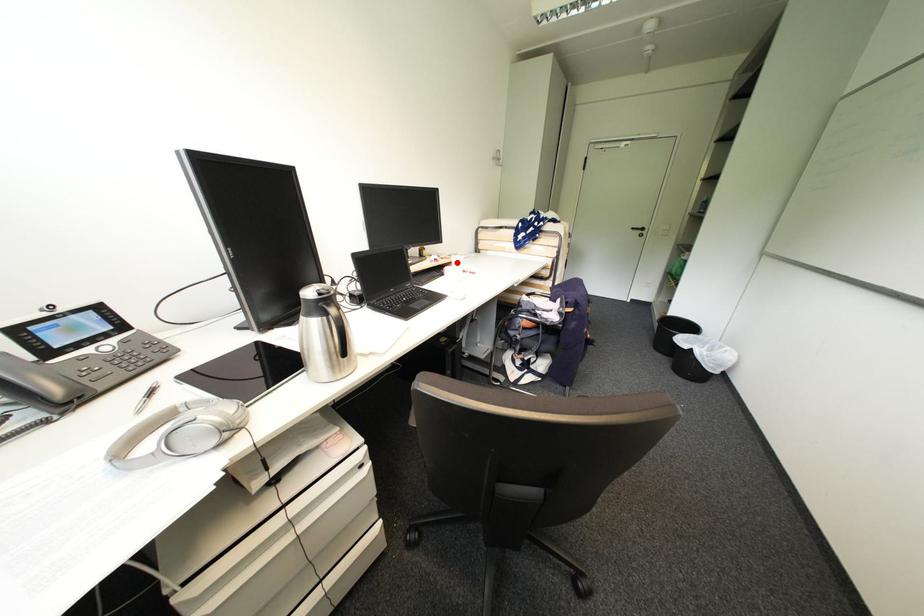
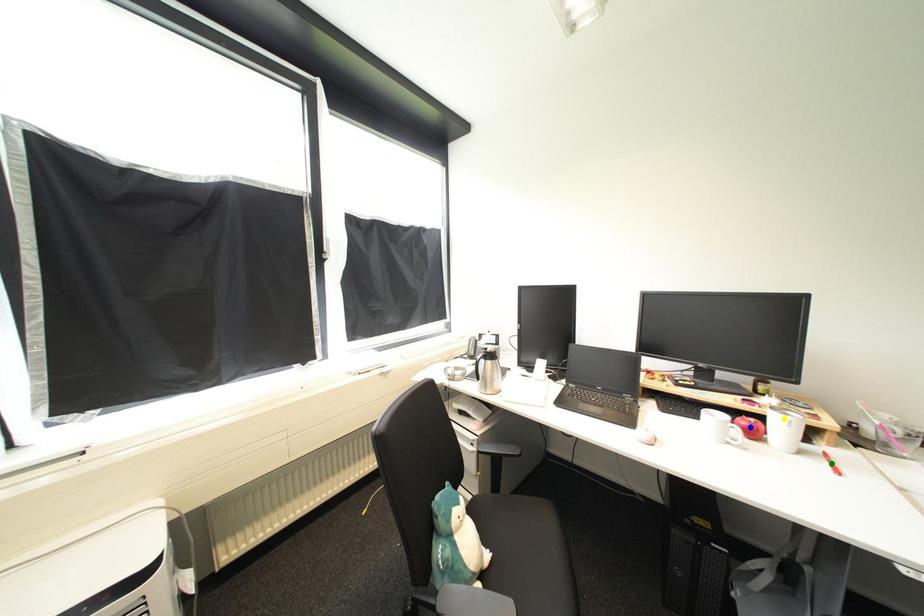
Question: I am providing you with two images of the same scene from different viewpoints. A red point is marked on the first image. You are given multiple points on the second image. Which point in image 2 represents the same 3d spot as the red point in image 1?

Choices:
 (A) blue point
 (B) yellow point
 (C) green point

Answer: (B)